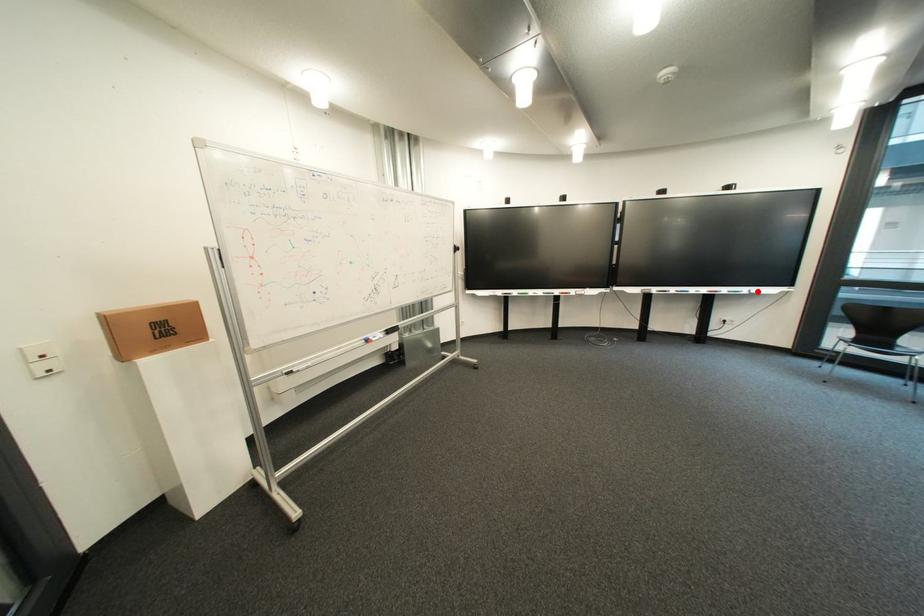
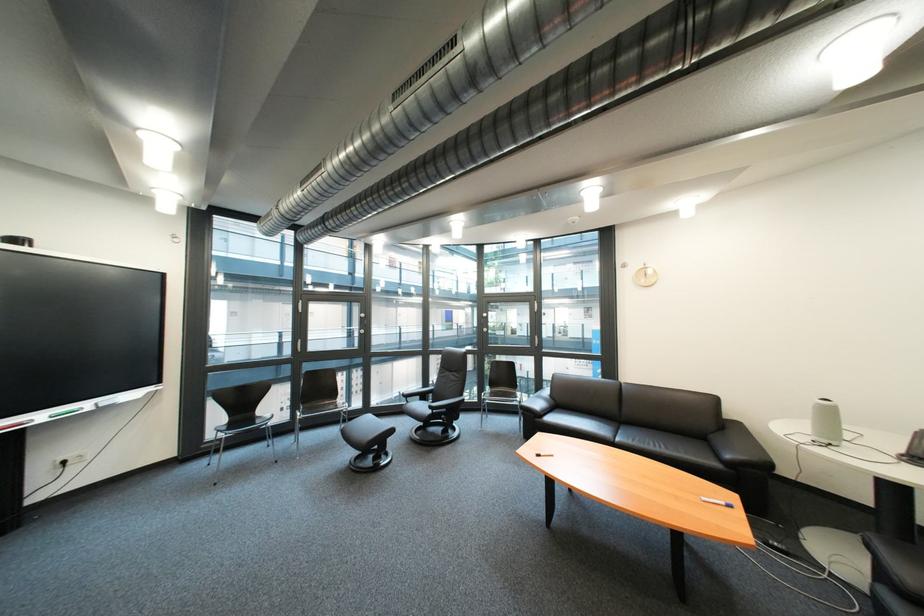
In the second image, find the point that corresponds to the highlighted location in the first image.

(101, 406)